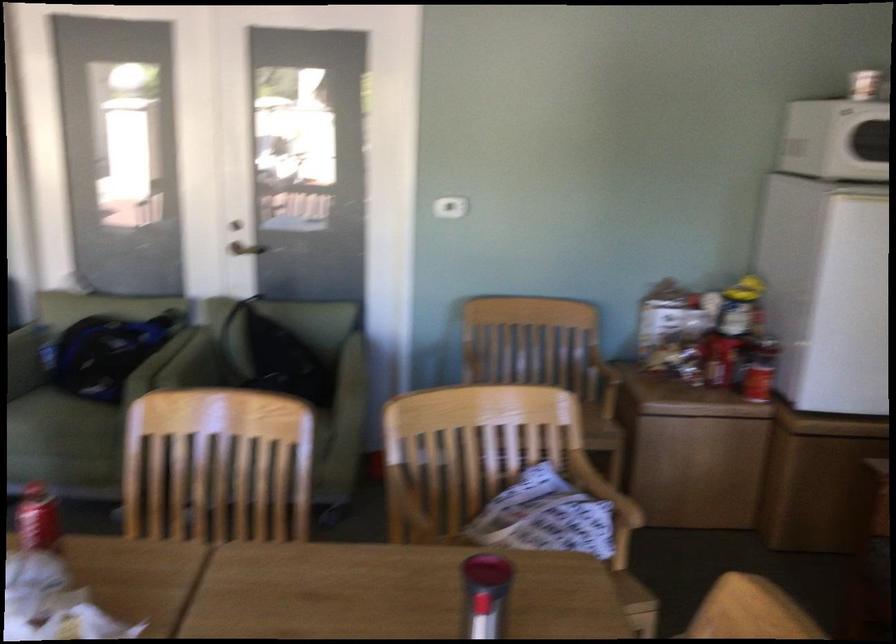
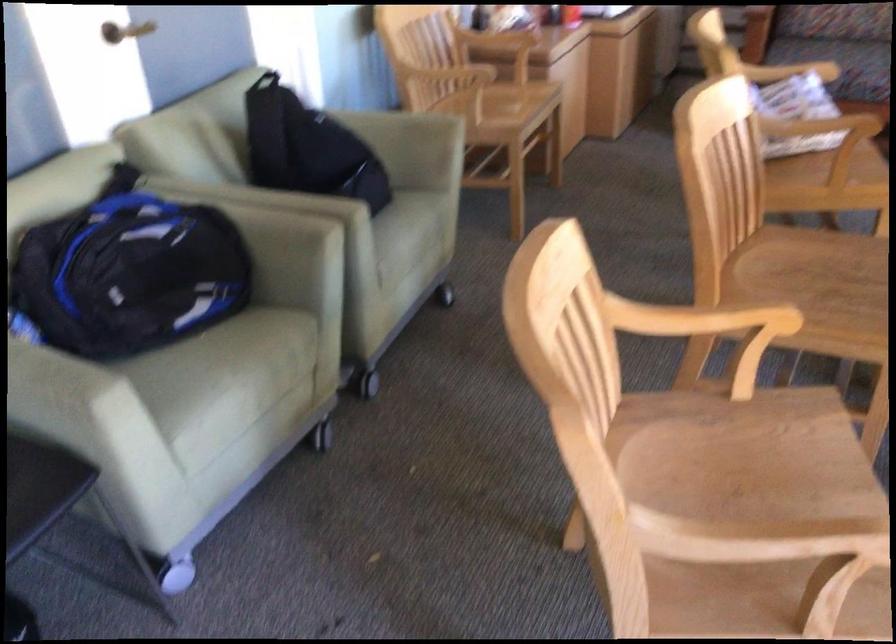
Find the pixel in the second image that matches (x=72, y=379) in the first image.

(126, 315)